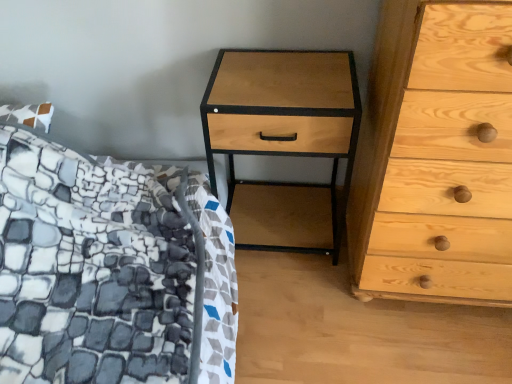
The width and height of the screenshot is (512, 384). I want to click on free space between natural wood nightstand at center and natural wood chest of drawers at right, so click(x=300, y=281).